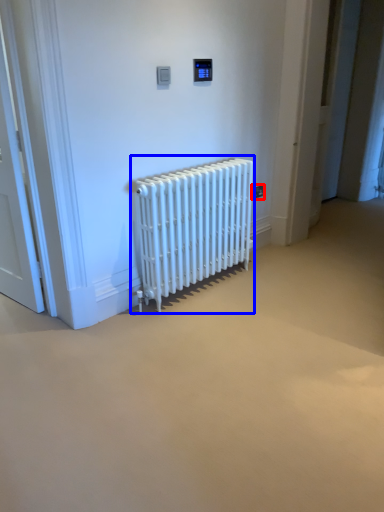
Question: Among these objects, which one is nearest to the camera, electric outlet (highlighted by a red box) or radiator (highlighted by a blue box)?

Choices:
 (A) electric outlet
 (B) radiator

Answer: (B)